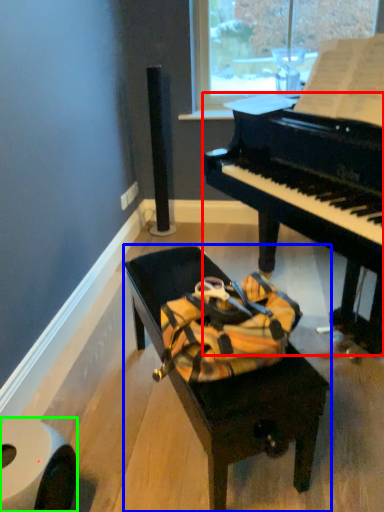
Question: Based on their relative distances, which object is farther from piano (highlighted by a red box)? Choose from furniture (highlighted by a blue box) and toilet paper (highlighted by a green box).

Choices:
 (A) furniture
 (B) toilet paper

Answer: (B)